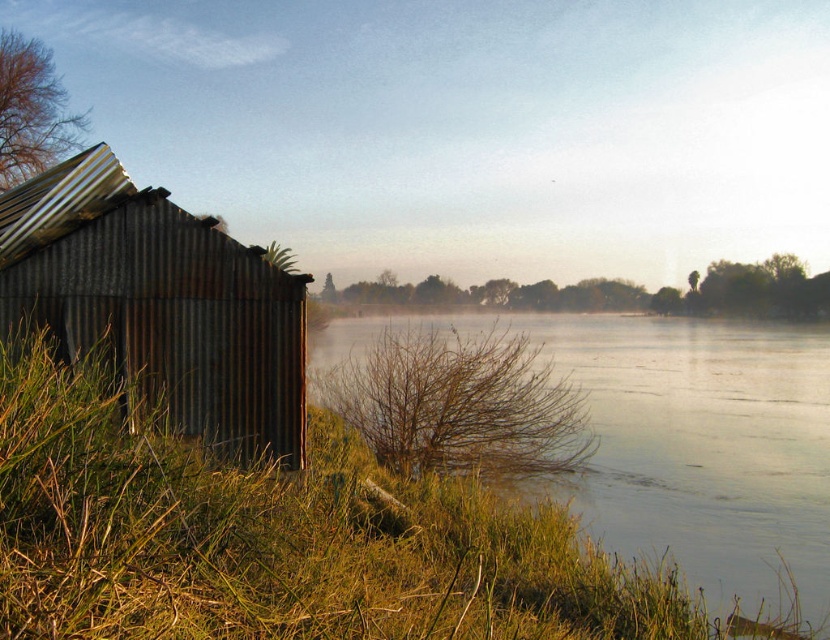
You are standing on the grassy bank and want to walk to the water. Which object will you encounter first, the green grassy river at lower left or the rusty corrugated hut at left?

The green grassy river at lower left is in front of the rusty corrugated hut at left, so you will encounter the green grassy river at lower left first when walking towards the water.

You are standing at the center of the image and want to walk to the green grassy river at lower left. Which direction should you face to walk directly towards it?

You should face the lower left direction to walk directly towards the green grassy river at lower left.